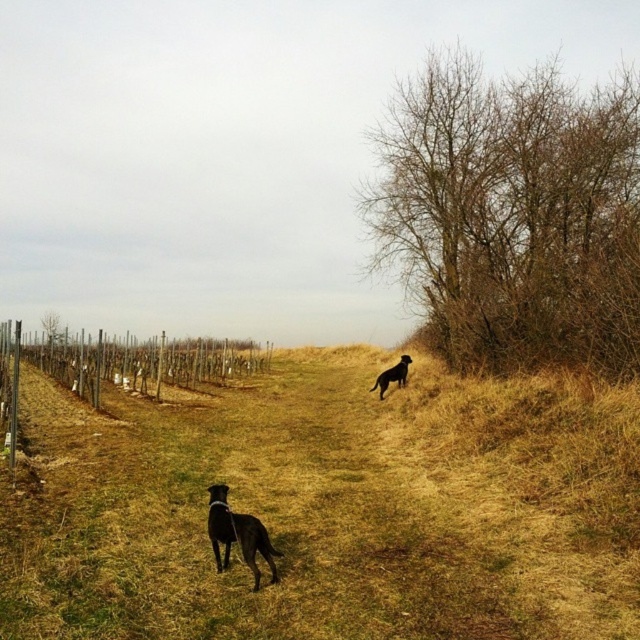
Question: Based on their relative distances, which object is nearer to the dry grass at center?

Choices:
 (A) black matte dog at center
 (B) shiny black dog at center

Answer: (B)

Question: Observing the image, what is the correct spatial positioning of dry grass at center in reference to wooden posts at left?

Choices:
 (A) right
 (B) left

Answer: (A)

Question: Which point is closer to the camera taking this photo?

Choices:
 (A) (544, 452)
 (B) (401, 356)
 (C) (492, 97)
 (D) (248, 545)

Answer: (D)

Question: Can you confirm if wooden posts at left is positioned to the left of shiny black dog at center?

Choices:
 (A) no
 (B) yes

Answer: (B)

Question: Does dry grass at center appear over wooden posts at left?

Choices:
 (A) no
 (B) yes

Answer: (A)

Question: Among these points, which one is farthest from the camera?

Choices:
 (A) (225, 504)
 (B) (97, 401)

Answer: (B)